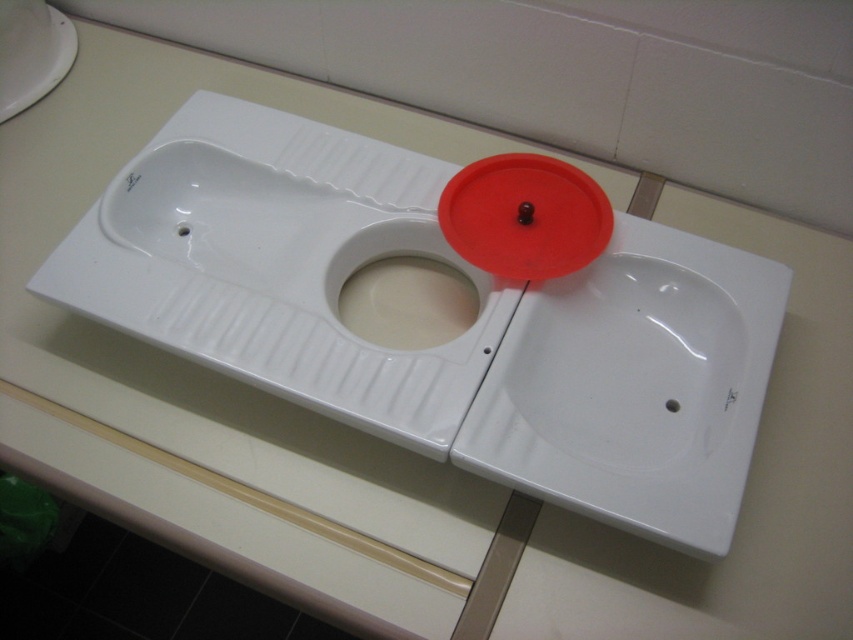
Locate an element on the screen. The image size is (853, 640). white glossy sink at center is located at coordinates (447, 342).

Can you confirm if white glossy sink at center is positioned above red matte lid at center?

Incorrect, white glossy sink at center is not positioned above red matte lid at center.

Is point (700, 426) behind point (508, 188)?

No.

The width and height of the screenshot is (853, 640). Find the location of `white glossy sink at center`. white glossy sink at center is located at coordinates (447, 342).